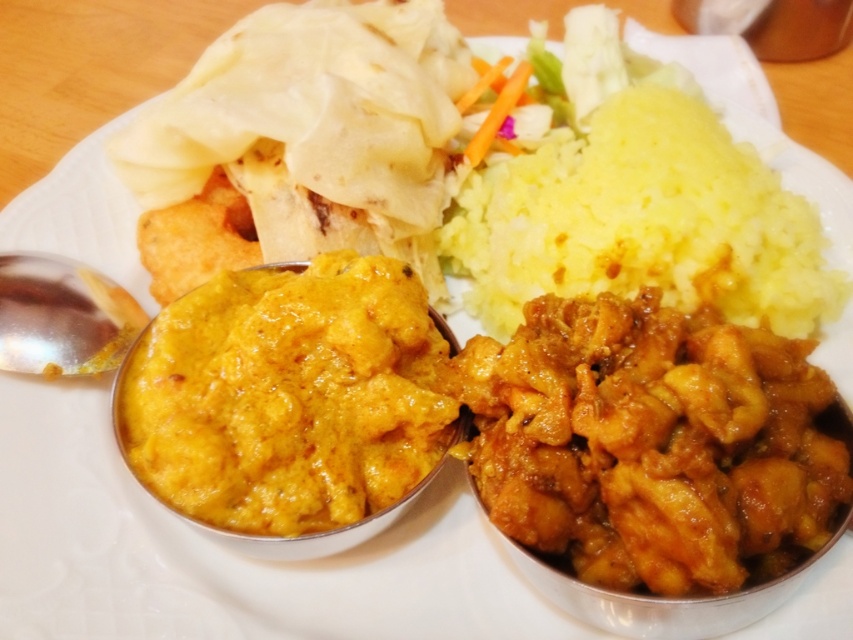
Is point (363, 429) behind point (749, 200)?

No, it is not.

Between yellow creamy curry at center and yellow/yellowish-white/mashed rice at upper right, which one has less height?

yellow creamy curry at center is shorter.

You are a GUI agent. You are given a task and a screenshot of the screen. Output one action in this format:
    pyautogui.click(x=<x>, y=<y>)
    Task: Click on the yellow creamy curry at center
    The image size is (853, 640).
    Given the screenshot: What is the action you would take?
    pyautogui.click(x=288, y=396)

Image resolution: width=853 pixels, height=640 pixels. What are the coordinates of `yellow creamy curry at center` in the screenshot? It's located at (288, 396).

Who is more forward, [485,472] or [16,275]?

Point [485,472] is in front.

In order to click on brown glossy chicken curry at center in this screenshot , I will do `click(648, 442)`.

Who is more forward, [766,397] or [10,285]?

Point [766,397]

This screenshot has height=640, width=853. Find the location of `brown glossy chicken curry at center`. brown glossy chicken curry at center is located at coordinates (648, 442).

Which of these two, brown glossy chicken curry at center or yellow creamy curry at center, stands taller?

Standing taller between the two is yellow creamy curry at center.

Which is behind, point (509, 348) or point (154, 330)?

Point (154, 330)

This screenshot has height=640, width=853. I want to click on brown glossy chicken curry at center, so click(x=648, y=442).